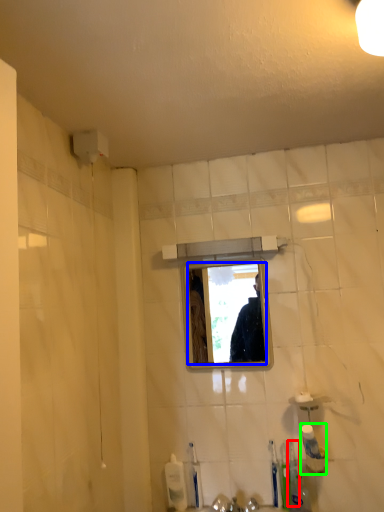
Question: Estimate the real-world distances between objects in this image. Which object is farther from toothbrush (highlighted by a red box), mirror (highlighted by a blue box) or toiletry (highlighted by a green box)?

Choices:
 (A) mirror
 (B) toiletry

Answer: (A)